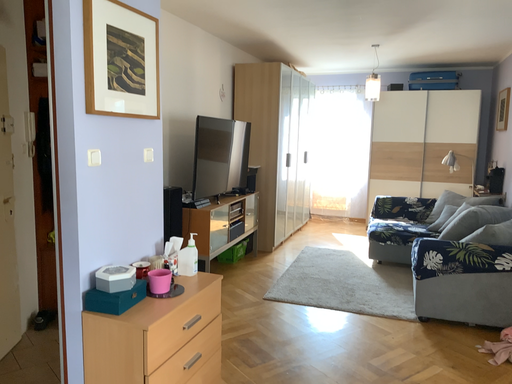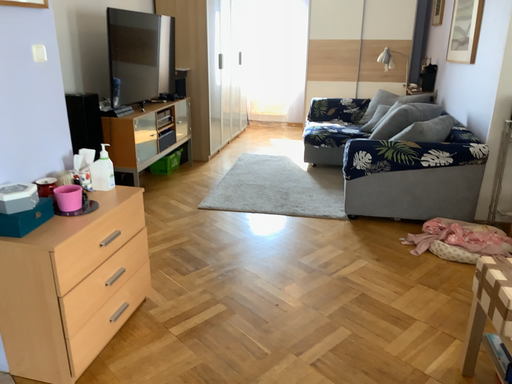
Question: Which way did the camera rotate in the video?

Choices:
 (A) rotated right
 (B) rotated left

Answer: (A)